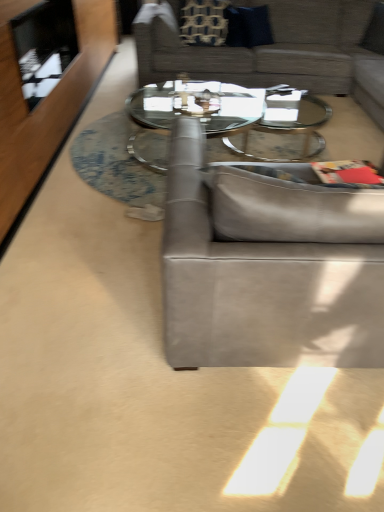
Question: Is patterned fabric pillow at upper center, arranged as the first pillow when viewed from the left, to the left of textured gray couch at upper center, acting as the first studio couch starting from the back, from the viewer's perspective?

Choices:
 (A) no
 (B) yes

Answer: (B)

Question: Is textured gray couch at upper center, acting as the first studio couch starting from the back, at the back of patterned fabric pillow at upper center, arranged as the first pillow when viewed from the left?

Choices:
 (A) no
 (B) yes

Answer: (B)

Question: Is patterned fabric pillow at upper center, arranged as the first pillow when viewed from the left, not close to textured gray couch at upper center, which is the second studio couch in front-to-back order?

Choices:
 (A) no
 (B) yes

Answer: (A)

Question: Is patterned fabric pillow at upper center, arranged as the first pillow when viewed from the left, closer to the viewer compared to textured gray couch at upper center, which is the second studio couch in front-to-back order?

Choices:
 (A) yes
 (B) no

Answer: (B)

Question: From a real-world perspective, does patterned fabric pillow at upper center, marked as the second pillow in a right-to-left arrangement, stand above textured gray couch at upper center, which is the second studio couch in front-to-back order?

Choices:
 (A) yes
 (B) no

Answer: (A)

Question: Considering the relative sizes of patterned fabric pillow at upper center, marked as the second pillow in a right-to-left arrangement, and textured gray couch at upper center, acting as the first studio couch starting from the back, in the image provided, is patterned fabric pillow at upper center, marked as the second pillow in a right-to-left arrangement, taller than textured gray couch at upper center, acting as the first studio couch starting from the back,?

Choices:
 (A) yes
 (B) no

Answer: (B)

Question: Can you confirm if clear glass coffee table at center is bigger than suede gray couch at center, the 2th studio couch positioned from the top?

Choices:
 (A) yes
 (B) no

Answer: (B)

Question: Is clear glass coffee table at center at the right side of suede gray couch at center, which is the 1th studio couch in front-to-back order?

Choices:
 (A) no
 (B) yes

Answer: (A)

Question: Does clear glass coffee table at center have a lesser height compared to suede gray couch at center, the 2th studio couch positioned from the top?

Choices:
 (A) yes
 (B) no

Answer: (A)

Question: Is clear glass coffee table at center placed right next to suede gray couch at center, placed as the 1th studio couch when sorted from bottom to top?

Choices:
 (A) yes
 (B) no

Answer: (B)

Question: Is clear glass coffee table at center looking in the opposite direction of suede gray couch at center, the 2th studio couch positioned from the top?

Choices:
 (A) yes
 (B) no

Answer: (B)

Question: Is clear glass coffee table at center outside of suede gray couch at center, which is the 1th studio couch in front-to-back order?

Choices:
 (A) no
 (B) yes

Answer: (B)

Question: Considering the relative sizes of patterned fabric pillow at upper center, arranged as the first pillow when viewed from the left, and clear glass coffee table at center in the image provided, is patterned fabric pillow at upper center, arranged as the first pillow when viewed from the left, bigger than clear glass coffee table at center?

Choices:
 (A) yes
 (B) no

Answer: (B)